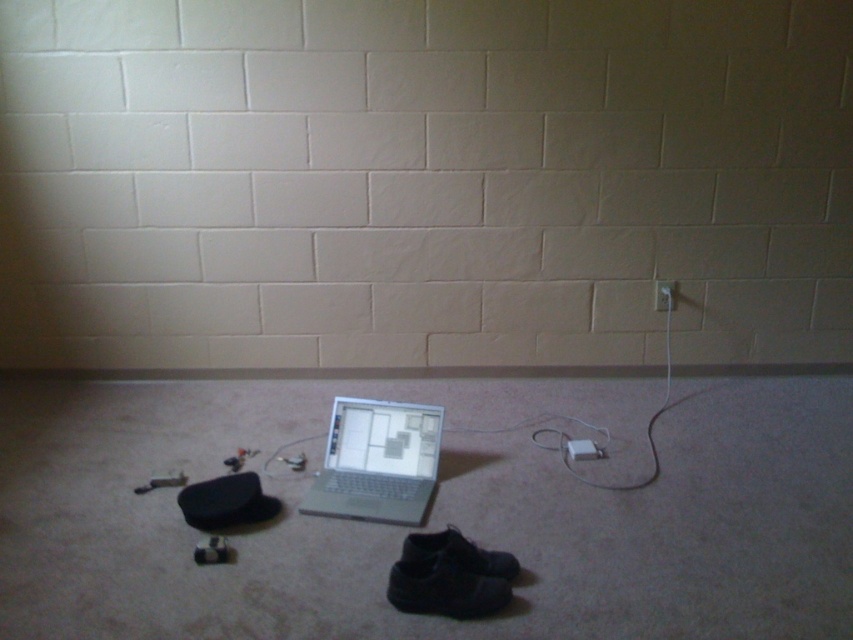
Who is higher up, white plastic plug at lower center or white plastic electric outlet at upper right?

Positioned higher is white plastic electric outlet at upper right.

Which is below, white plastic plug at lower center or white plastic electric outlet at upper right?

white plastic plug at lower center

Is point (595, 449) closer to viewer compared to point (666, 292)?

Yes, it is.

Find the location of a particular element. The image size is (853, 640). white plastic plug at lower center is located at coordinates (582, 449).

Is silver metallic laptop at center shorter than white plastic electric outlet at upper right?

No, silver metallic laptop at center is not shorter than white plastic electric outlet at upper right.

Who is positioned more to the left, silver metallic laptop at center or white plastic electric outlet at upper right?

Positioned to the left is silver metallic laptop at center.

Who is more forward, (x=351, y=416) or (x=674, y=292)?

Point (x=351, y=416) is in front.

The height and width of the screenshot is (640, 853). What are the coordinates of `silver metallic laptop at center` in the screenshot? It's located at (376, 461).

Can you confirm if silver metallic laptop at center is positioned above white plastic plug at lower center?

No, silver metallic laptop at center is not above white plastic plug at lower center.

Locate an element on the screen. This screenshot has width=853, height=640. silver metallic laptop at center is located at coordinates (376, 461).

Locate an element on the screen. Image resolution: width=853 pixels, height=640 pixels. silver metallic laptop at center is located at coordinates (376, 461).